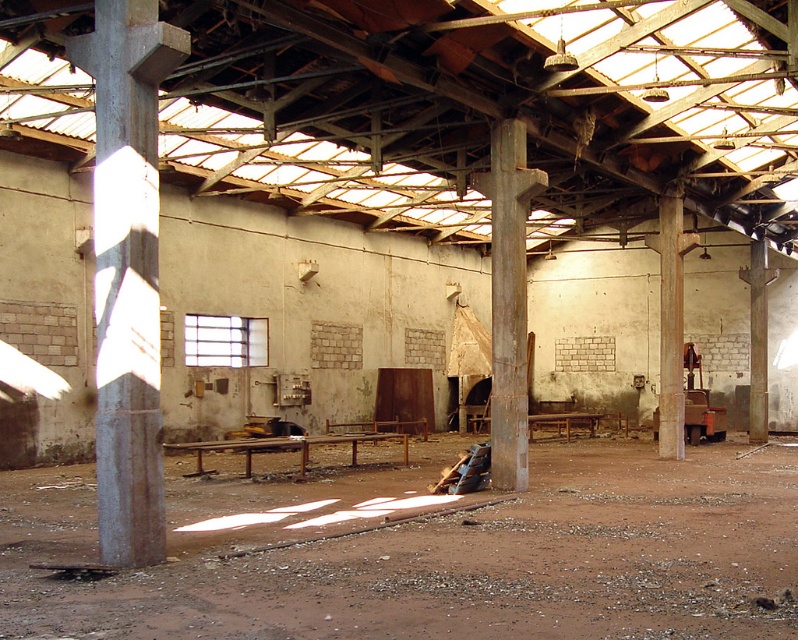
You are a construction worker needing to place a 15 meter long steel beam between the concrete at left and the smooth concrete pillar at right. Can you fit the beam between them?

The distance between the concrete at left and the smooth concrete pillar at right is 16.74 meters, so the 15 meter long steel beam can be placed between them as there is enough space.

You are a maintenance worker needing to replace a damaged cable that runs between the rusty metal pillar at center and the smooth concrete pillar at right. The cable must be at least 30 feet long to ensure proper tension. Based on the scene, will the existing cable be sufficient?

The distance between the rusty metal pillar at center and the smooth concrete pillar at right is 29.83 feet. Since the required minimum length is 30 feet, the existing cable is slightly too short and would not provide adequate tension. A longer cable is needed.